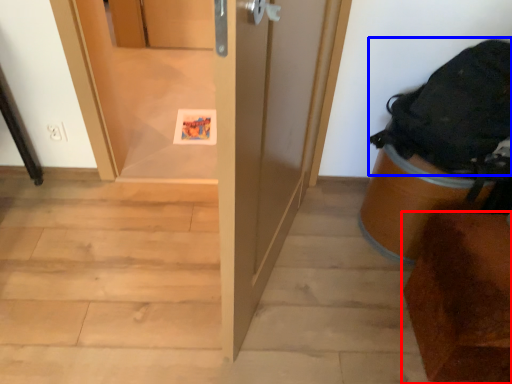
Question: Which point is closer to the camera, furniture (highlighted by a red box) or backpack (highlighted by a blue box)?

Choices:
 (A) furniture
 (B) backpack

Answer: (A)